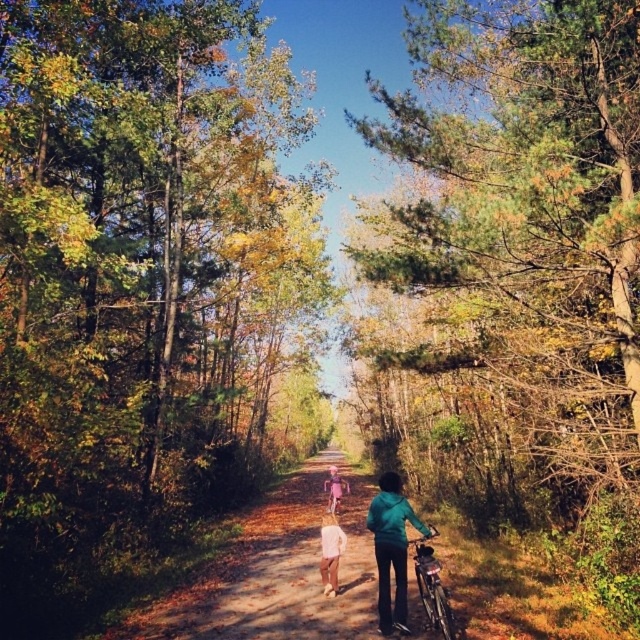
Measure the distance between shiny metallic bicycle at center and camera.

shiny metallic bicycle at center and camera are 6.64 meters apart from each other.

Which is above, shiny metallic bicycle at center or pink fabric dress at center?

Positioned higher is shiny metallic bicycle at center.

Is point (419, 592) in front of point (339, 483)?

Yes.

I want to click on shiny metallic bicycle at center, so coord(432,586).

Who is positioned more to the left, brown dirt path at center or shiny metallic bicycle at center?

brown dirt path at center is more to the left.

Can you confirm if brown dirt path at center is taller than shiny metallic bicycle at center?

Indeed, brown dirt path at center has a greater height compared to shiny metallic bicycle at center.

You are a GUI agent. You are given a task and a screenshot of the screen. Output one action in this format:
    pyautogui.click(x=<x>, y=<y>)
    Task: Click on the brown dirt path at center
    Image resolution: width=640 pixels, height=640 pixels.
    Given the screenshot: What is the action you would take?
    pyautogui.click(x=276, y=573)

Is green pine tree at center above teal fabric jacket at center?

Indeed, green pine tree at center is positioned over teal fabric jacket at center.

Does green pine tree at center appear on the left side of teal fabric jacket at center?

Incorrect, green pine tree at center is not on the left side of teal fabric jacket at center.

Between point (636, 198) and point (372, 524), which one is positioned behind?

Point (372, 524)

This screenshot has width=640, height=640. In order to click on green pine tree at center in this screenshot , I will do `click(525, 221)`.